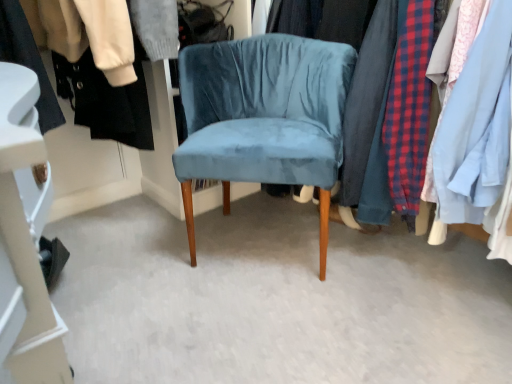
Image resolution: width=512 pixels, height=384 pixels. I want to click on empty space that is to the right of black fabric shoe at lower left, the first closet positioned from the left, so click(132, 271).